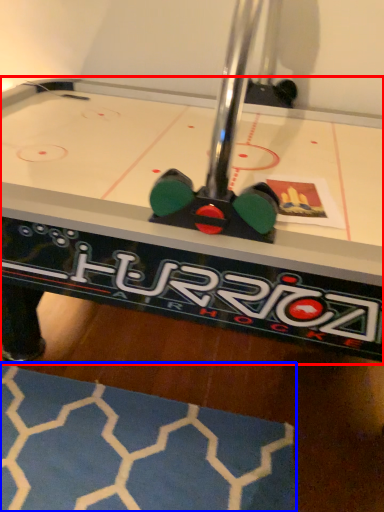
Question: Which of the following is the closest to the observer, table (highlighted by a red box) or mat (highlighted by a blue box)?

Choices:
 (A) table
 (B) mat

Answer: (A)